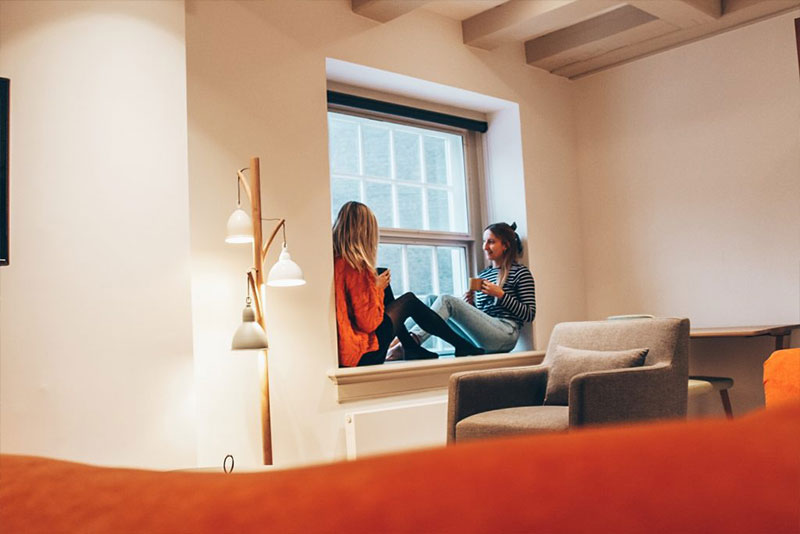
What are the coordinates of `right chair arm` in the screenshot? It's located at (465, 379).